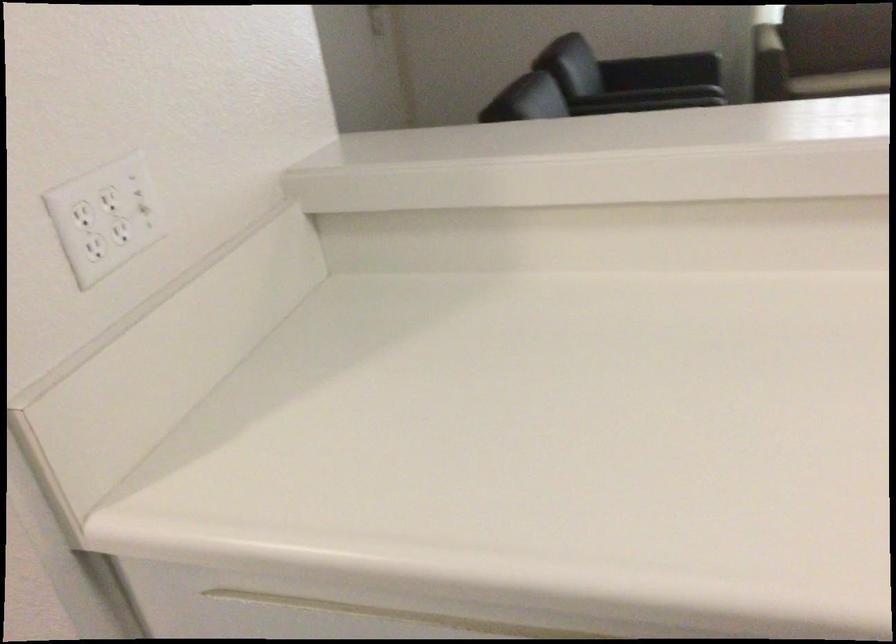
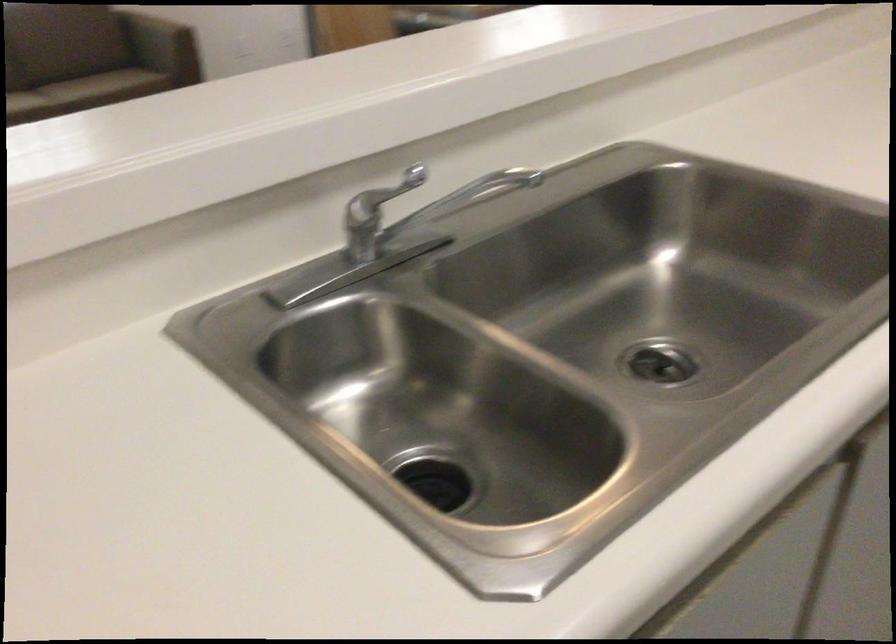
Question: The first image is from the beginning of the video and the second image is from the end. How did the camera likely rotate when shooting the video?

Choices:
 (A) Left
 (B) Right
 (C) Up
 (D) Down

Answer: (B)